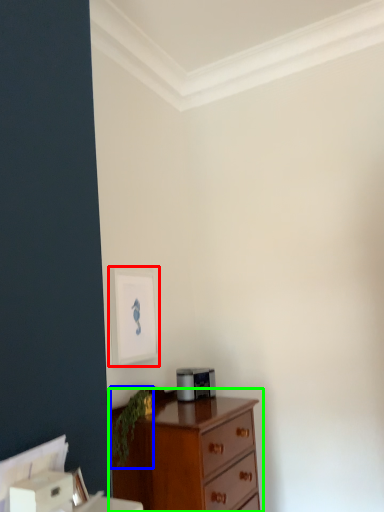
Question: Which object is positioned closest to picture frame (highlighted by a red box)? Select from plant (highlighted by a blue box) and chest of drawers (highlighted by a green box).

Choices:
 (A) plant
 (B) chest of drawers

Answer: (A)